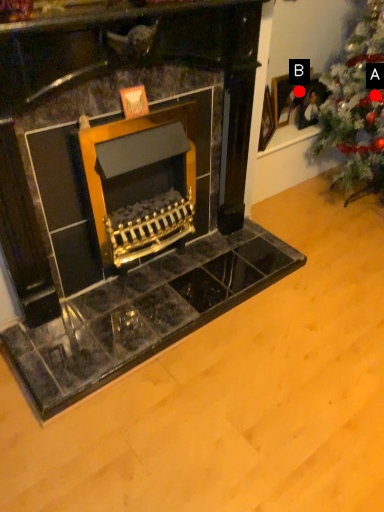
Question: Two points are circled on the image, labeled by A and B beside each circle. Which point appears closest to the camera in this image?

Choices:
 (A) A is closer
 (B) B is closer

Answer: (A)